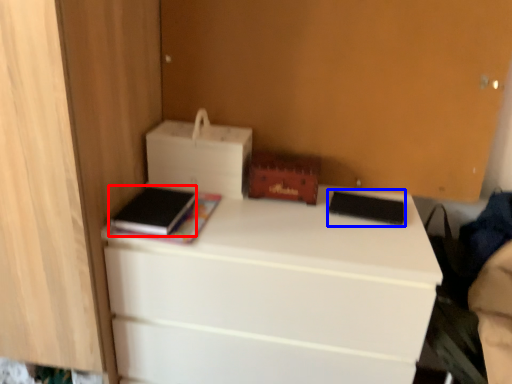
Question: Which point is closer to the camera, paperback book (highlighted by a red box) or paperback book (highlighted by a blue box)?

Choices:
 (A) paperback book
 (B) paperback book

Answer: (A)